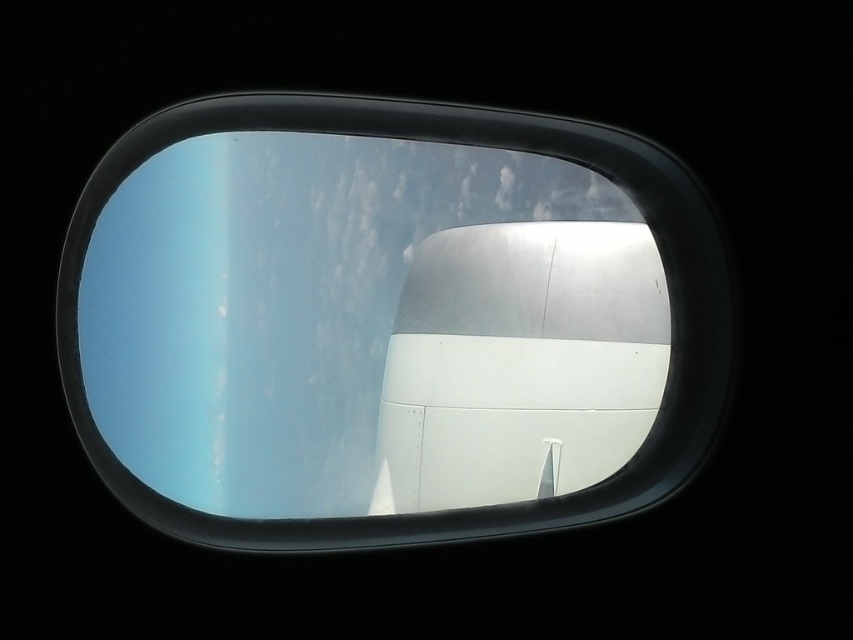
Consider the image. You are a flight attendant checking the airplane engine from inside the cabin. The engine must be within 20 centimeters of the window to be visible. Can you see the white matte airplane engine at center through the transparent glass airplane window at center?

The transparent glass airplane window at center is 17.91 centimeters away from the white matte airplane engine at center, which is within the 20 centimeter requirement. Therefore, you can see the white matte airplane engine at center through the transparent glass airplane window at center.